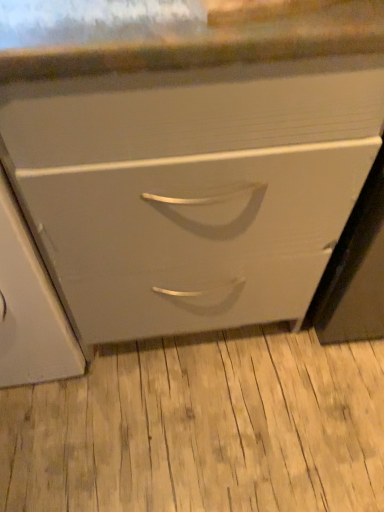
Identify the location of white glossy file cabinet at center. (30, 308).

Describe the element at coordinates (30, 308) in the screenshot. I see `white glossy file cabinet at center` at that location.

The width and height of the screenshot is (384, 512). In order to click on white glossy file cabinet at center in this screenshot , I will do click(30, 308).